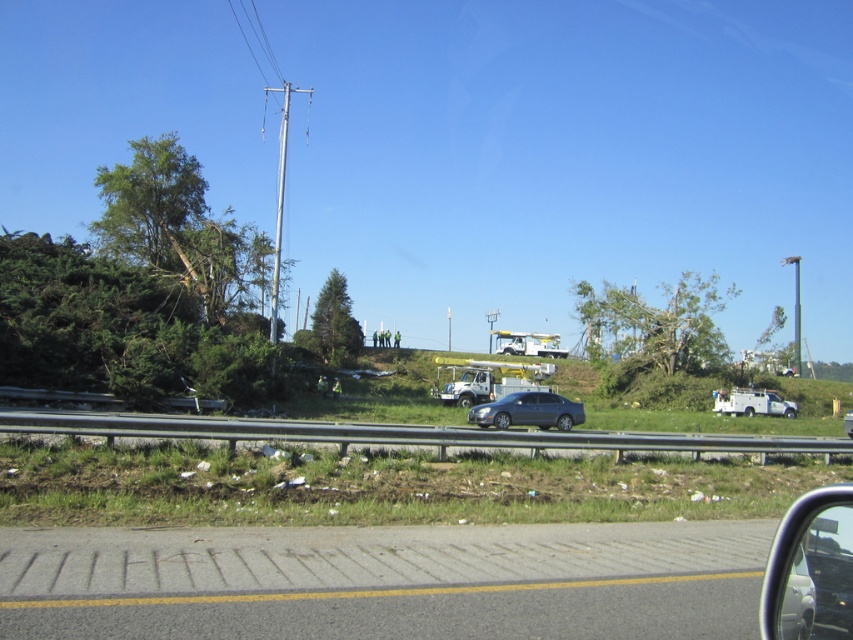
You are driving a car and want to check if the green leafy tree at center is visible through the clear glass car window at lower right. Based on their distance, can you see the tree through the window?

The green leafy tree at center is 219.55 feet away from the clear glass car window at lower right. Since the distance is quite large, the tree would likely appear small and possibly obstructed by the window frame or other elements, making it not clearly visible through the window.

You are a passenger in a car and want to see the fallen trees beyond the guardrail. Which object, the clear glass car window at lower right or the satin gray sedan at center, offers a better view of the fallen trees beyond the guardrail?

The clear glass car window at lower right offers a better view of the fallen trees beyond the guardrail because it is larger than the satin gray sedan at center, allowing for a wider and clearer perspective.